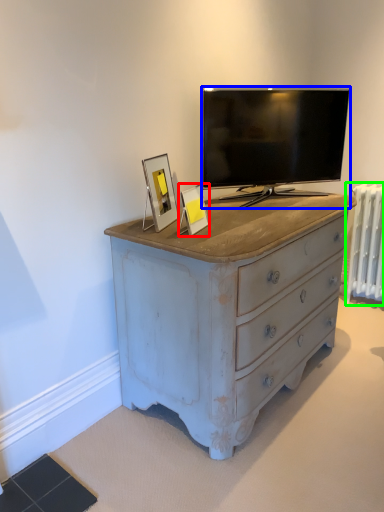
Question: Estimate the real-world distances between objects in this image. Which object is farther from picture frame (highlighted by a red box), television (highlighted by a blue box) or radiator (highlighted by a green box)?

Choices:
 (A) television
 (B) radiator

Answer: (B)